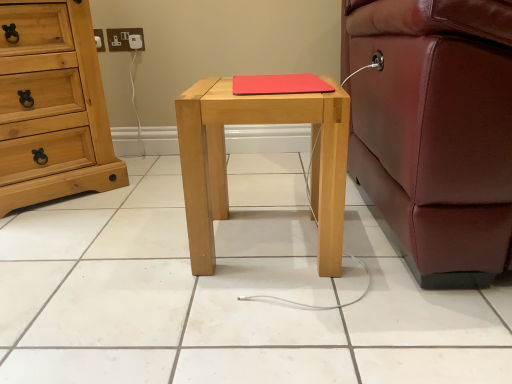
I want to click on free space above light wood/texture nightstand at center (from a real-world perspective), so click(271, 81).